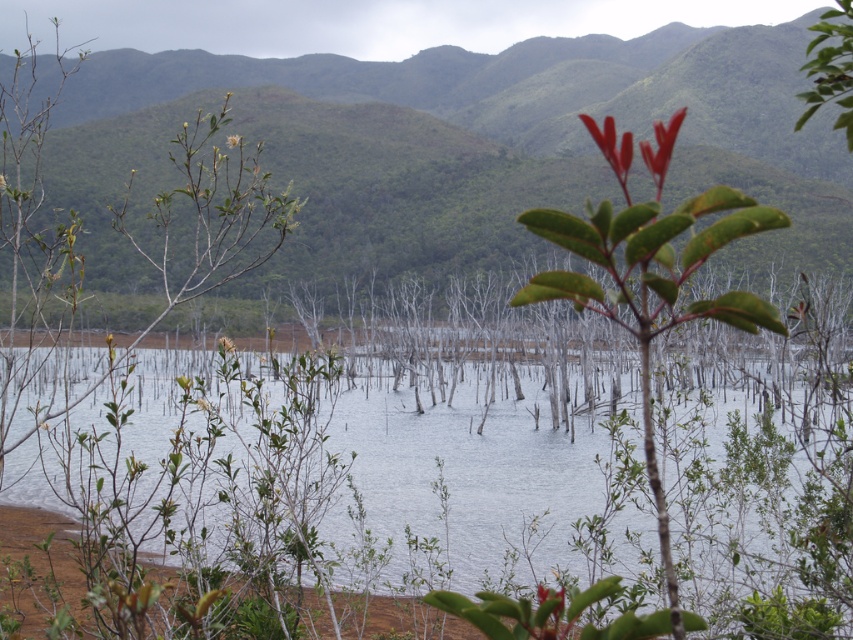
You are an artist trying to paint the scene. You notice the glossy red leaves at upper center and the green matte flower at upper center. Which object should you paint first if you want to depict the thinner one before the thicker one?

You should paint the glossy red leaves at upper center first because they are thinner than the green matte flower at upper center.

You are an artist sketching the landscape and want to include the glossy red leaves at upper center in your drawing. Where exactly should you place them on your paper if the paper is divided into a grid with coordinates from 0 to 1 in both horizontal and vertical directions?

You should place the glossy red leaves at upper center at the coordinate point of (611, 145) on your paper.

You are standing at the point labeled point [641,147] and want to walk to the point labeled point [202,403]. Which direction should you move to get closer to your destination?

To move from point [641,147] to point [202,403], you should move towards the lower right direction since point [641,147] is closer to the camera than point [202,403].